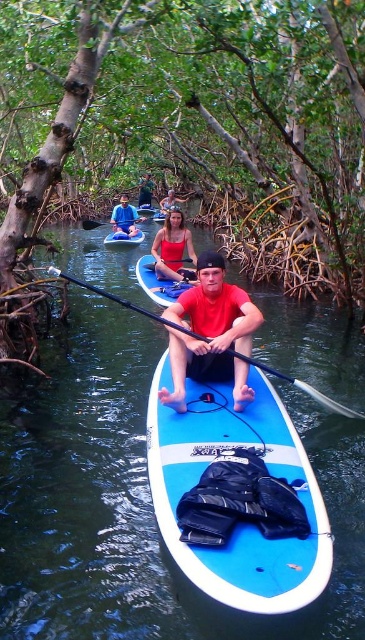
Measure the distance from blue foam paddle at center to matte red kayak at center.

blue foam paddle at center and matte red kayak at center are 20.85 meters apart from each other.

Does blue foam paddle at center have a greater width compared to matte red kayak at center?

Indeed, blue foam paddle at center has a greater width compared to matte red kayak at center.

Is point (51, 273) positioned after point (162, 209)?

No, it is in front of (162, 209).

I want to click on blue foam paddle at center, so click(x=301, y=387).

Is point (139, 186) in front of point (164, 209)?

No, it is not.

Who is shorter, green fabric shirt at upper center or matte red kayak at center?

green fabric shirt at upper center

Is point (147, 177) positioned after point (171, 198)?

Yes.

At what (x,y) coordinates should I click in order to perform the action: click on green fabric shirt at upper center. Please return your answer as a coordinate pair (x, y). Looking at the image, I should click on (144, 192).

Can you confirm if blue foam paddle at center is thinner than green fabric shirt at upper center?

No, blue foam paddle at center is not thinner than green fabric shirt at upper center.

From the picture: Does blue foam paddle at center have a smaller size compared to green fabric shirt at upper center?

Correct, blue foam paddle at center occupies less space than green fabric shirt at upper center.

You are a GUI agent. You are given a task and a screenshot of the screen. Output one action in this format:
    pyautogui.click(x=<x>, y=<y>)
    Task: Click on the blue foam paddle at center
    The height and width of the screenshot is (640, 365).
    Given the screenshot: What is the action you would take?
    pyautogui.click(x=301, y=387)